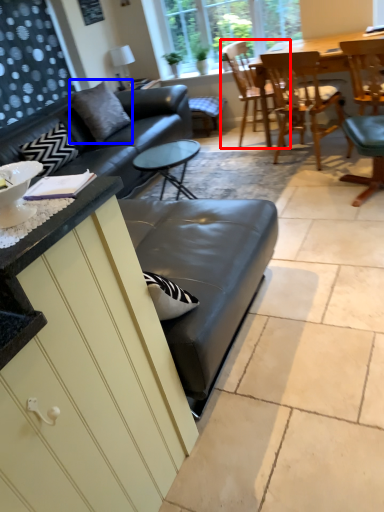
Question: Which of the following is the closest to the observer, chair (highlighted by a red box) or pillow (highlighted by a blue box)?

Choices:
 (A) chair
 (B) pillow

Answer: (B)